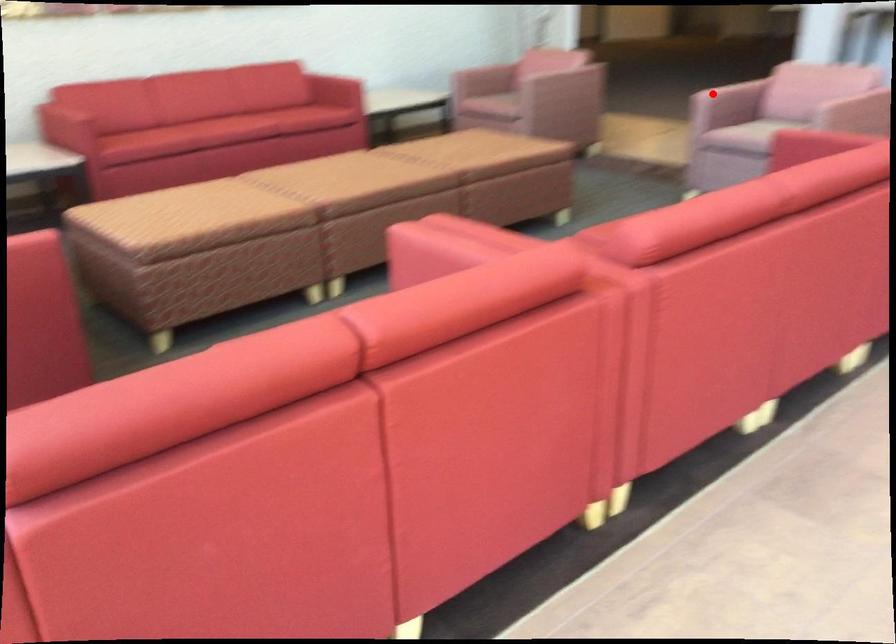
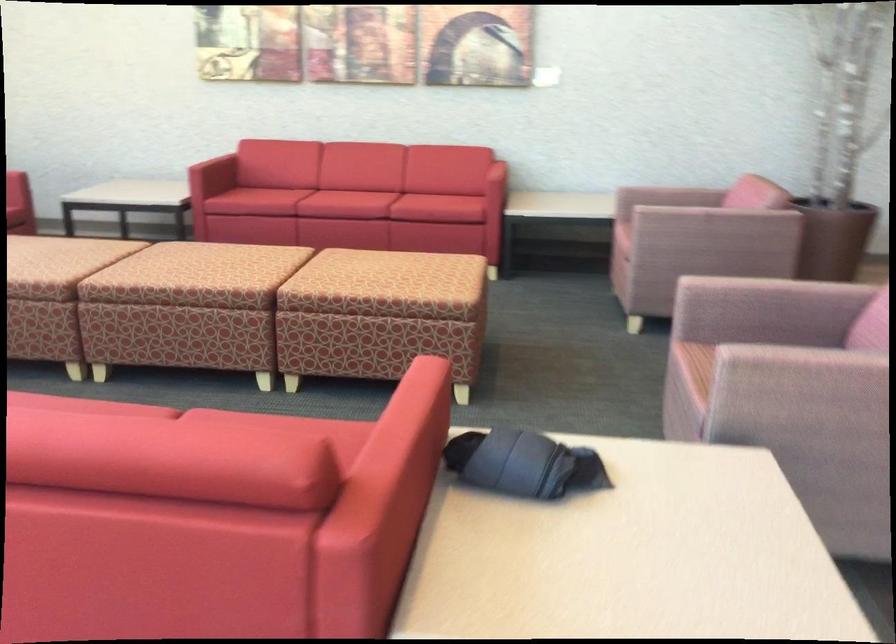
The point at the highlighted location is marked in the first image. Where is the corresponding point in the second image?

(728, 278)